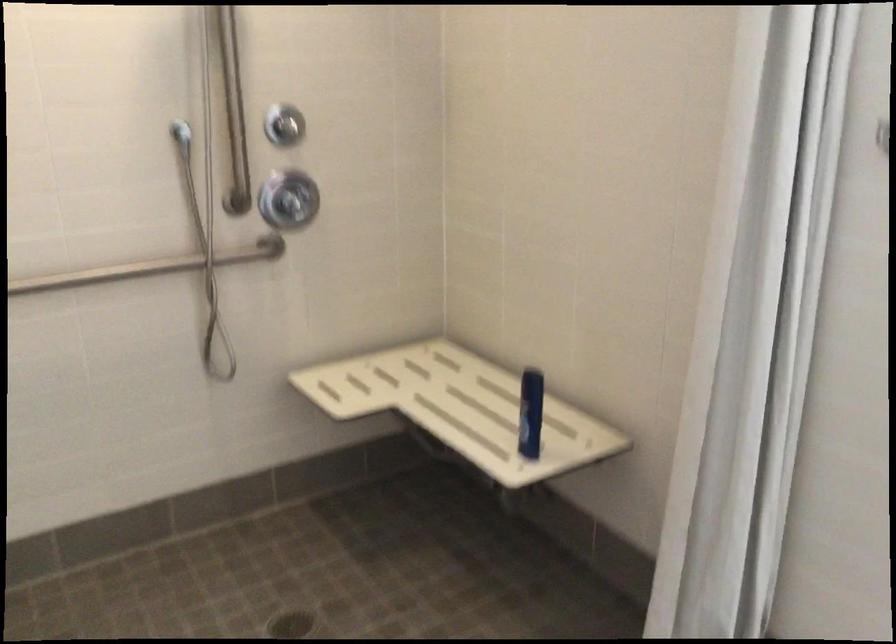
Where is `metal grab bar`? The height and width of the screenshot is (644, 896). metal grab bar is located at coordinates (152, 267).